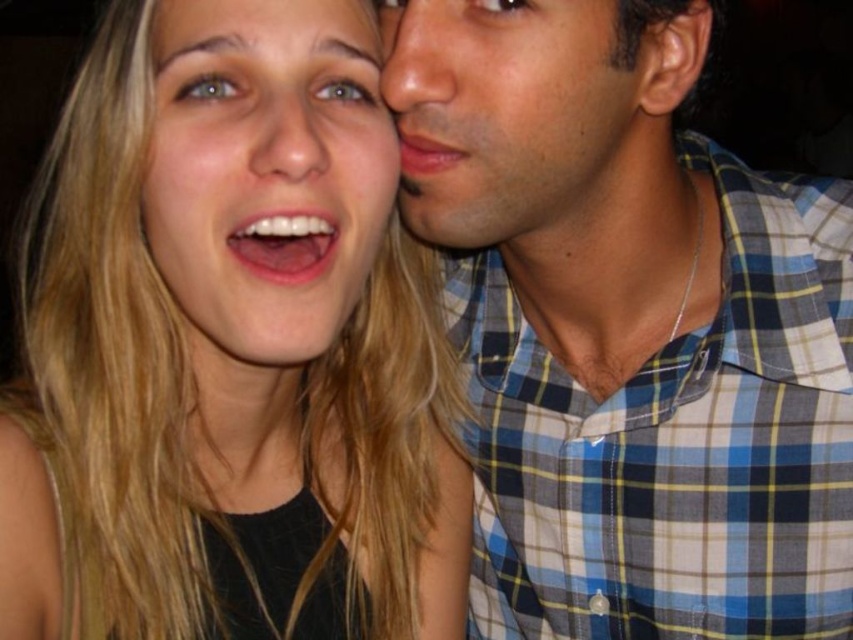
Is smooth skin face at upper right in front of matte skin forehead at upper center?

Yes, smooth skin face at upper right is closer to the viewer.

Does smooth skin face at upper right have a lesser height compared to matte skin forehead at upper center?

No.

Who is more forward, (x=621, y=182) or (x=368, y=10)?

Point (x=368, y=10) is more forward.

Locate an element on the screen. Image resolution: width=853 pixels, height=640 pixels. smooth skin face at upper right is located at coordinates (514, 124).

In the scene shown: Can you confirm if smooth skin face at upper right is positioned to the right of smooth skin nose at center?

Correct, you'll find smooth skin face at upper right to the right of smooth skin nose at center.

Who is more distant from viewer, (525,90) or (321,113)?

The point (525,90) is behind.

Identify the location of smooth skin face at upper right. The image size is (853, 640). (514, 124).

Is white glossy teeth at center below matte skin at right?

Indeed, white glossy teeth at center is positioned under matte skin at right.

Between point (299, 216) and point (434, 163), which one is positioned in front?

Positioned in front is point (299, 216).

This screenshot has width=853, height=640. In order to click on white glossy teeth at center in this screenshot , I will do `click(283, 244)`.